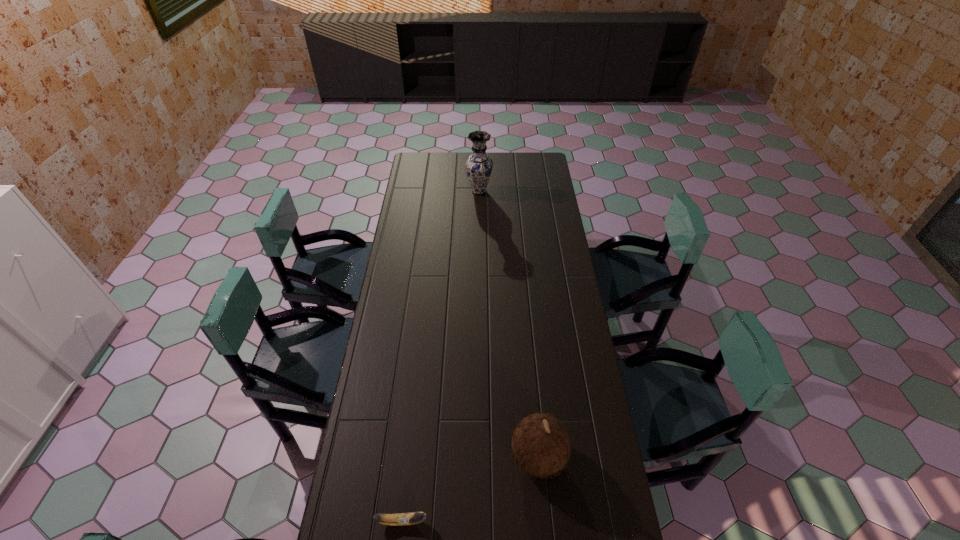
This screenshot has height=540, width=960. What are the coordinates of `the second object from right to left` in the screenshot? It's located at (479, 165).

Where is `the tallest object`? The width and height of the screenshot is (960, 540). the tallest object is located at coordinates (479, 165).

The image size is (960, 540). I want to click on the second nearest object, so click(x=540, y=444).

Identify the location of coconut. Image resolution: width=960 pixels, height=540 pixels. tap(540, 444).

Identify the location of banana. This screenshot has width=960, height=540. (401, 519).

Where is `the leftmost object`? The image size is (960, 540). the leftmost object is located at coordinates (401, 519).

Locate an element on the screen. This screenshot has height=540, width=960. free space located on the left of the farthest object is located at coordinates (444, 191).

Locate an element on the screen. Image resolution: width=960 pixels, height=540 pixels. vacant region located 0.350m on the surface of the coconut is located at coordinates (400, 456).

I want to click on free space located 0.330m on the surface of the coconut, so click(x=406, y=456).

Find the location of a particular element. free space located 0.090m on the surface of the coconut is located at coordinates (480, 456).